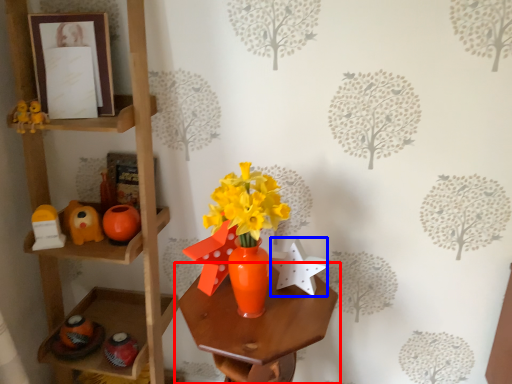
Question: Which object appears farthest to the camera in this image, table (highlighted by a red box) or toy (highlighted by a blue box)?

Choices:
 (A) table
 (B) toy

Answer: (B)